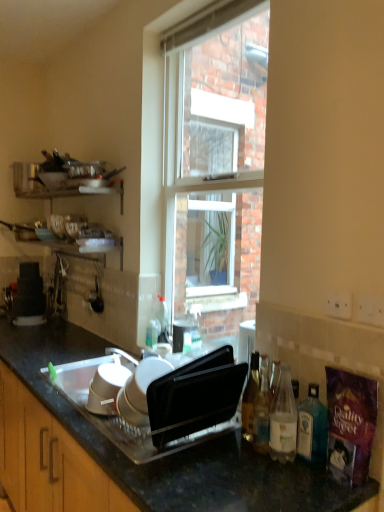
I want to click on vacant space situated on the left part of translucent glass bottle at right, positioned as the fourth bottle in right-to-left order, so click(x=209, y=444).